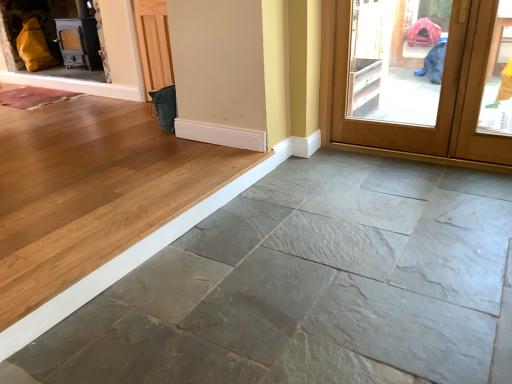
At what (x,y) coordinates should I click in order to perform the action: click on wooden door at right. Please return your answer as a coordinate pair (x, y). Looking at the image, I should click on (439, 99).

Image resolution: width=512 pixels, height=384 pixels. What do you see at coordinates (439, 99) in the screenshot?
I see `wooden door at right` at bounding box center [439, 99].

Identify the location of wooden door at right. The width and height of the screenshot is (512, 384). (439, 99).